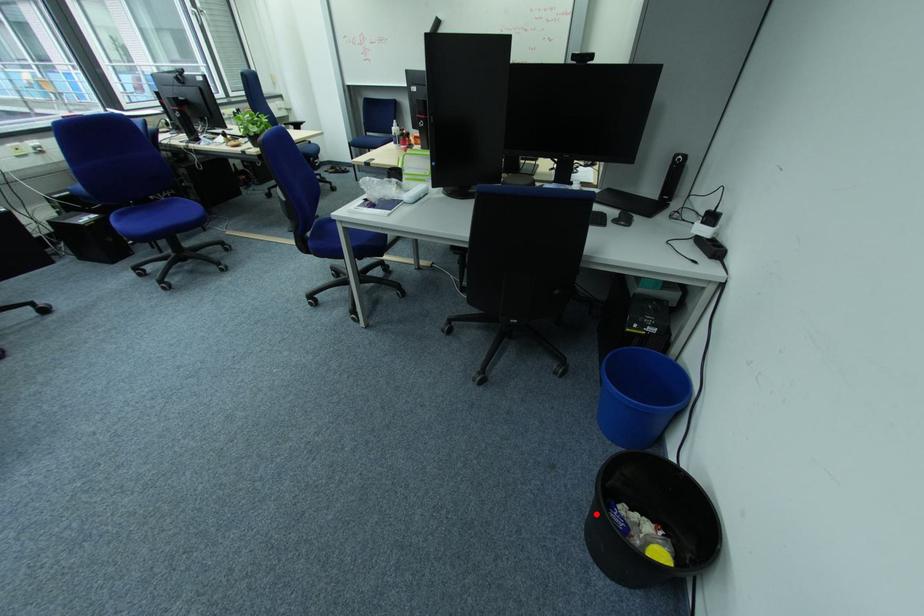
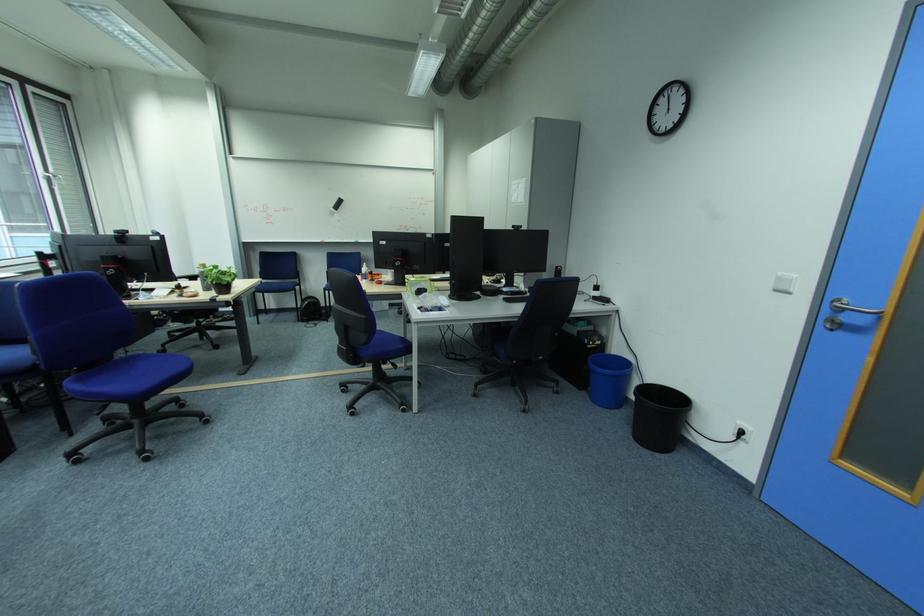
Question: A red point is marked in image1. In image2, is the corresponding 3D point closer to the camera or farther? Reply with the corresponding letter.

Choices:
 (A) The corresponding 3D point is closer.
 (B) The corresponding 3D point is farther.

Answer: (A)